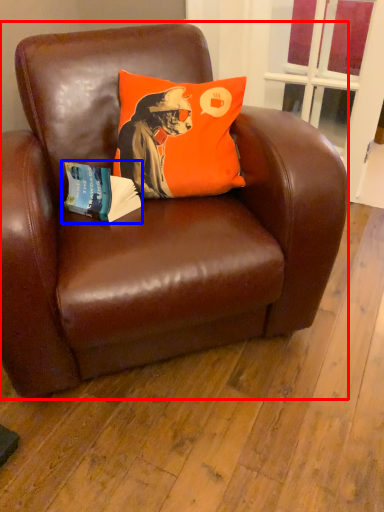
Question: Among these objects, which one is farthest to the camera, chair (highlighted by a red box) or paperback book (highlighted by a blue box)?

Choices:
 (A) chair
 (B) paperback book

Answer: (B)